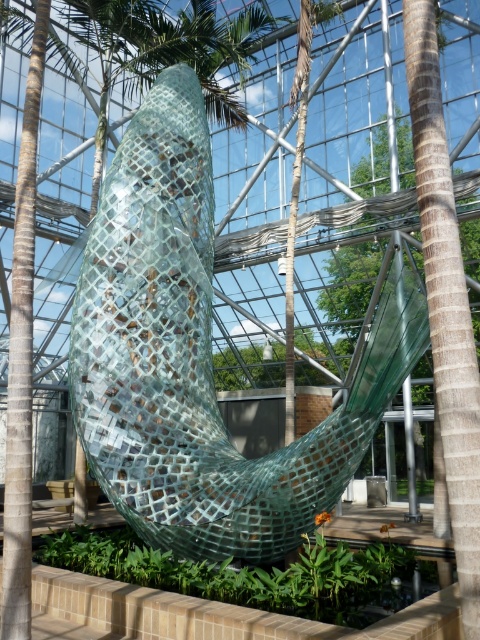
Looking at this image, between transparent glass sculpture at center and green textured glass at right, which one appears on the left side from the viewer's perspective?

From the viewer's perspective, transparent glass sculpture at center appears more on the left side.

Does point (223, 540) lie behind point (364, 170)?

No, it is not.

The width and height of the screenshot is (480, 640). Find the location of `transparent glass sculpture at center`. transparent glass sculpture at center is located at coordinates (199, 358).